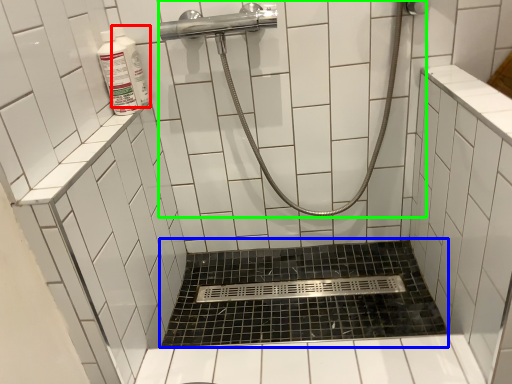
Question: Which object is the farthest from cleaning product (highlighted by a red box)? Choose among these: bath (highlighted by a blue box) or shower (highlighted by a green box).

Choices:
 (A) bath
 (B) shower

Answer: (A)